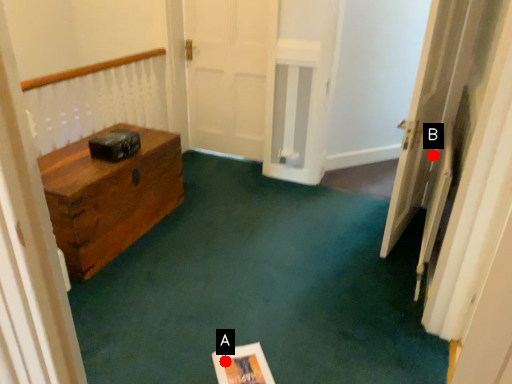
Question: Two points are circled on the image, labeled by A and B beside each circle. Which point is closer to the camera taking this photo?

Choices:
 (A) A is closer
 (B) B is closer

Answer: (A)